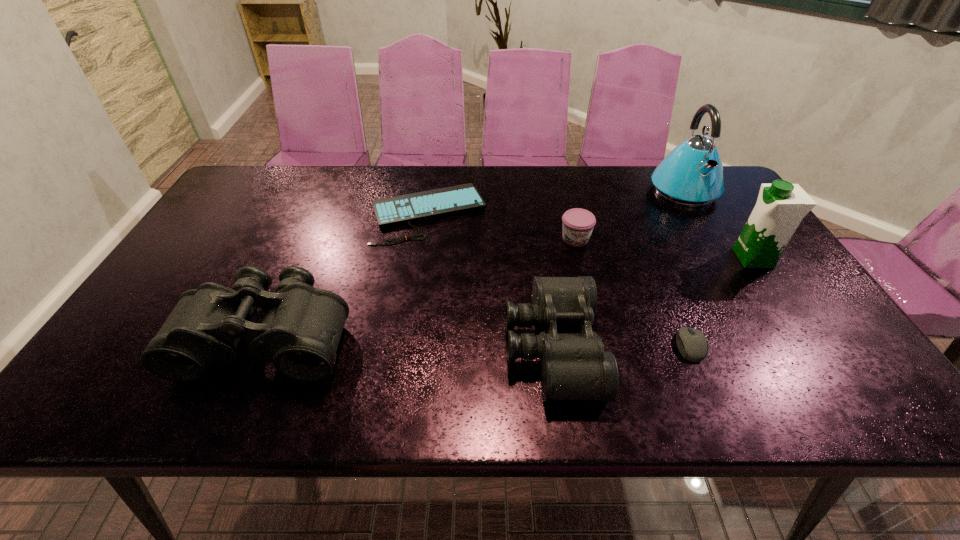
The height and width of the screenshot is (540, 960). Find the location of `the fifth shortest object`. the fifth shortest object is located at coordinates (300, 332).

The height and width of the screenshot is (540, 960). I want to click on the left binoculars, so click(x=300, y=332).

The width and height of the screenshot is (960, 540). Find the location of `the fourth tallest object`. the fourth tallest object is located at coordinates (574, 366).

The image size is (960, 540). I want to click on the right binoculars, so click(x=574, y=366).

Identify the location of the tallest object. This screenshot has height=540, width=960. (691, 175).

Where is `the shortest object`? Image resolution: width=960 pixels, height=540 pixels. the shortest object is located at coordinates (412, 207).

I want to click on jam, so coord(577,224).

Locate an element on the screen. The image size is (960, 540). the second tallest object is located at coordinates (781, 206).

The image size is (960, 540). I want to click on the sixth tallest object, so click(x=692, y=343).

Image resolution: width=960 pixels, height=540 pixels. Find the location of `the third object from right to left`. the third object from right to left is located at coordinates pos(692,343).